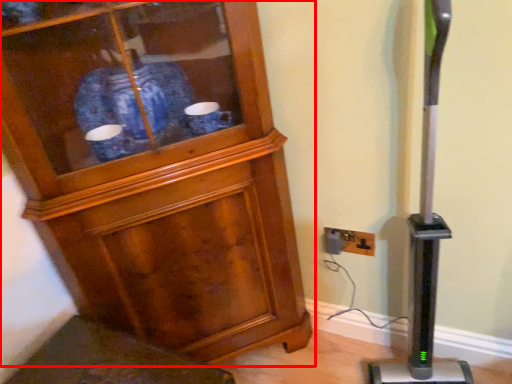
Question: From the image's perspective, what is the correct spatial positioning of cupboard (annotated by the red box) in reference to electric outlet?

Choices:
 (A) above
 (B) below

Answer: (A)